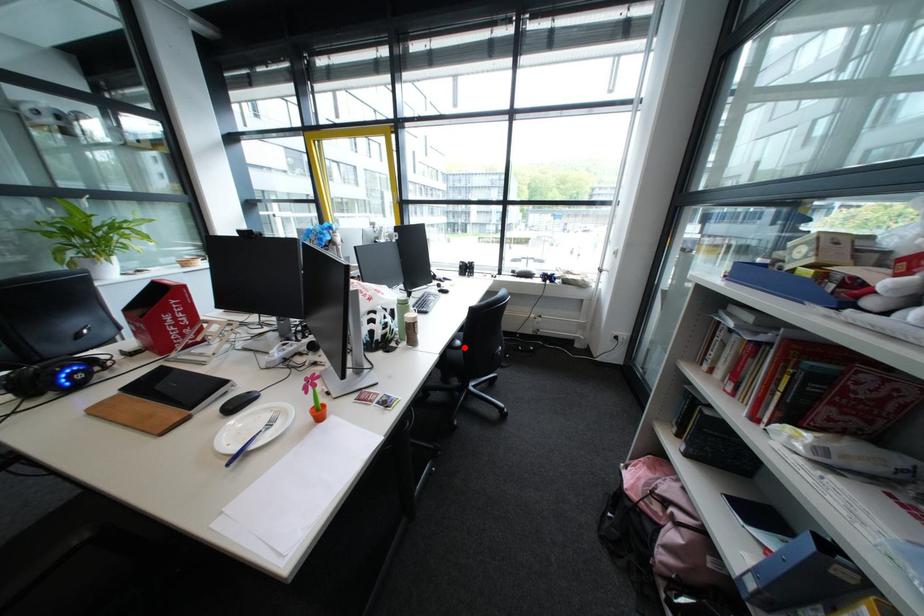
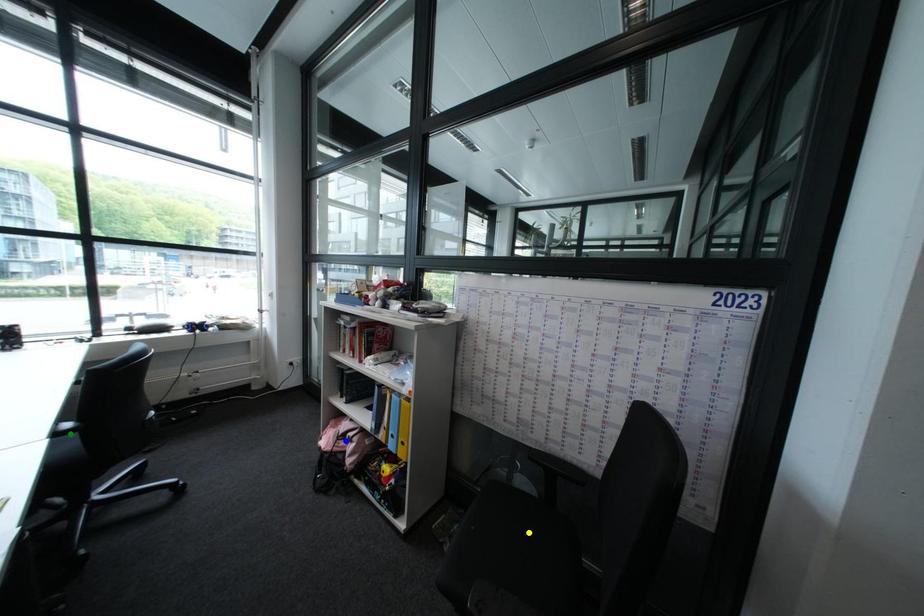
Question: I am providing you with two images of the same scene from different viewpoints. A red point is marked on the first image. You are given multiple points on the second image. Which mark in image 2 goes with the point in image 1?

Choices:
 (A) yellow point
 (B) green point
 (C) blue point

Answer: (B)